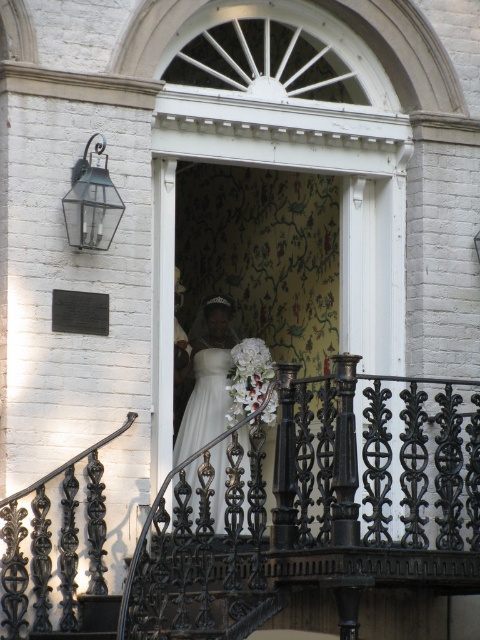
Question: In this image, where is black wrought iron railing at center located relative to white satin dress at center?

Choices:
 (A) right
 (B) left

Answer: (A)

Question: Does black wrought iron railing at center come in front of white silk bouquet at center?

Choices:
 (A) no
 (B) yes

Answer: (B)

Question: Based on their relative distances, which object is nearer to the white satin dress at center?

Choices:
 (A) white silk bouquet at center
 (B) black wrought iron railing at center

Answer: (B)

Question: Is black wrought iron railing at center smaller than white silk bouquet at center?

Choices:
 (A) yes
 (B) no

Answer: (B)

Question: Among these objects, which one is nearest to the camera?

Choices:
 (A) white silk bouquet at center
 (B) white satin dress at center
 (C) black wrought iron railing at center

Answer: (C)

Question: Among these points, which one is nearest to the camera?

Choices:
 (A) (228, 413)
 (B) (216, 376)

Answer: (A)